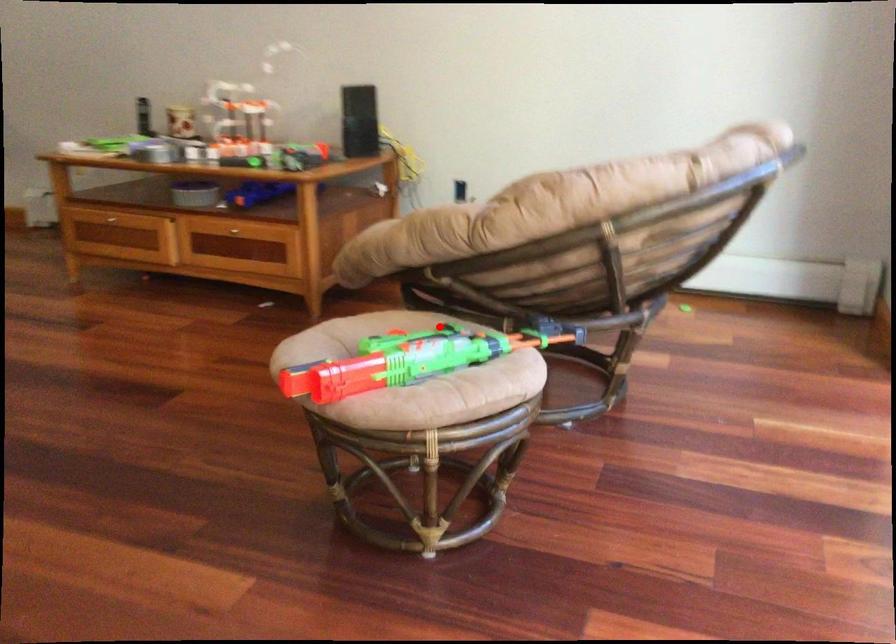
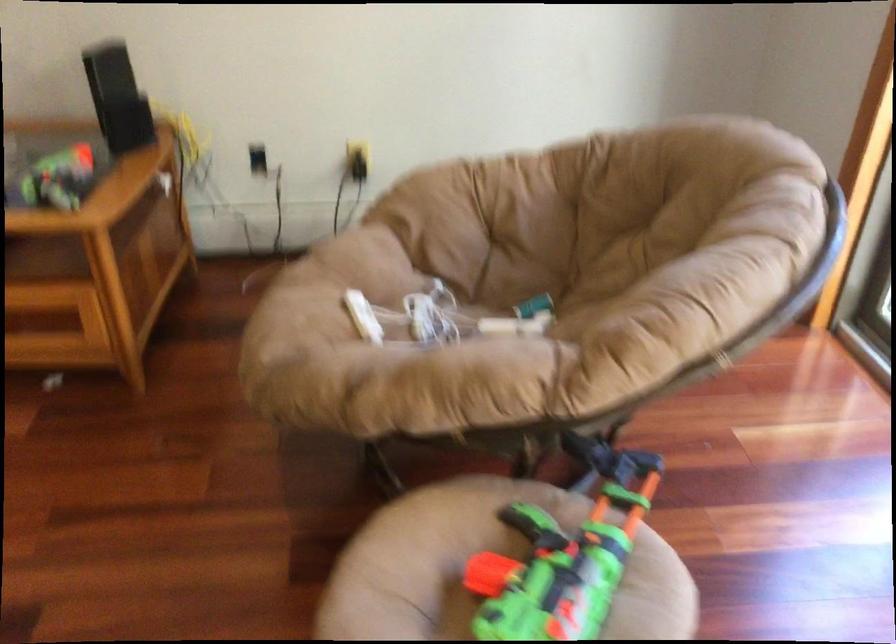
Locate, in the second image, the point that corresponds to the highlighted location in the first image.

(564, 554)